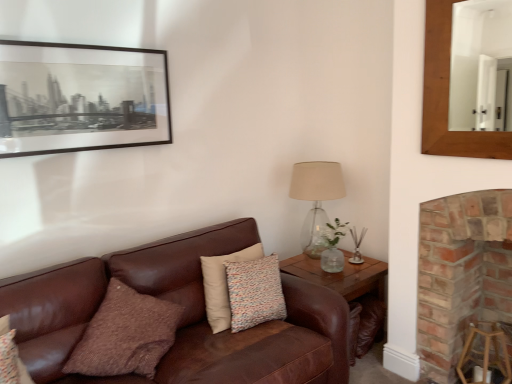
Identify the location of free space above wooden side table at lower right (from a real-world perspective). The height and width of the screenshot is (384, 512). (344, 272).